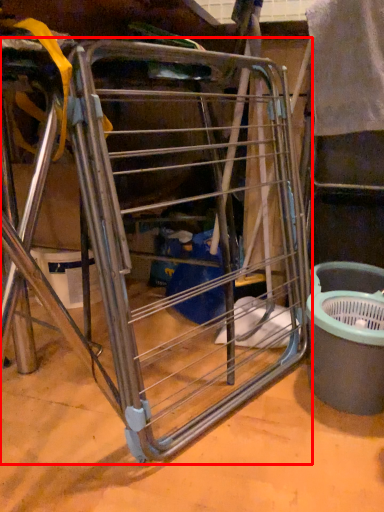
Question: Where is furniture (annotated by the red box) located in relation to recycling bin in the image?

Choices:
 (A) right
 (B) left

Answer: (B)